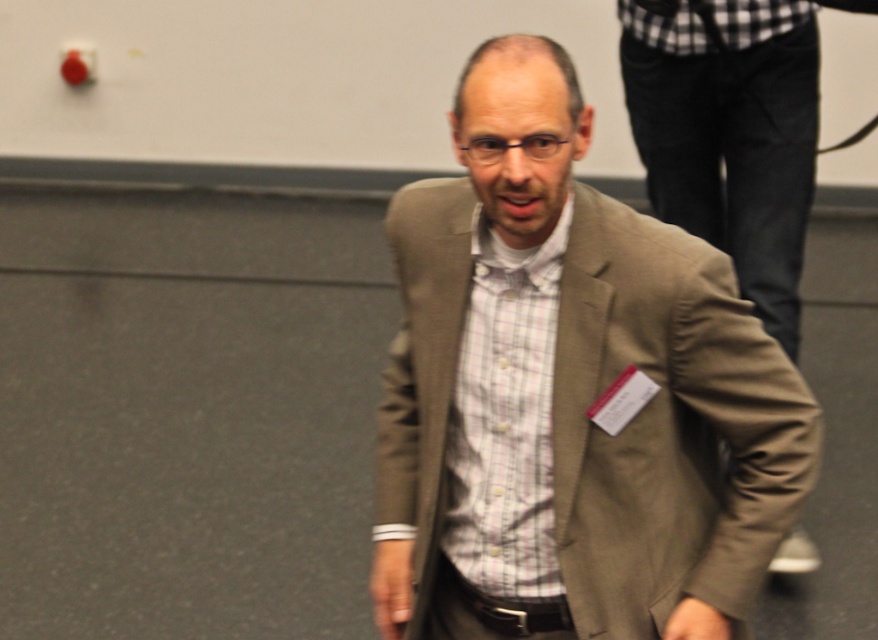
Does matte brown blazer at center have a greater width compared to matte beige blazer at center?

Yes.

Locate an element on the screen. matte brown blazer at center is located at coordinates (569, 396).

Locate an element on the screen. matte brown blazer at center is located at coordinates pyautogui.click(x=569, y=396).